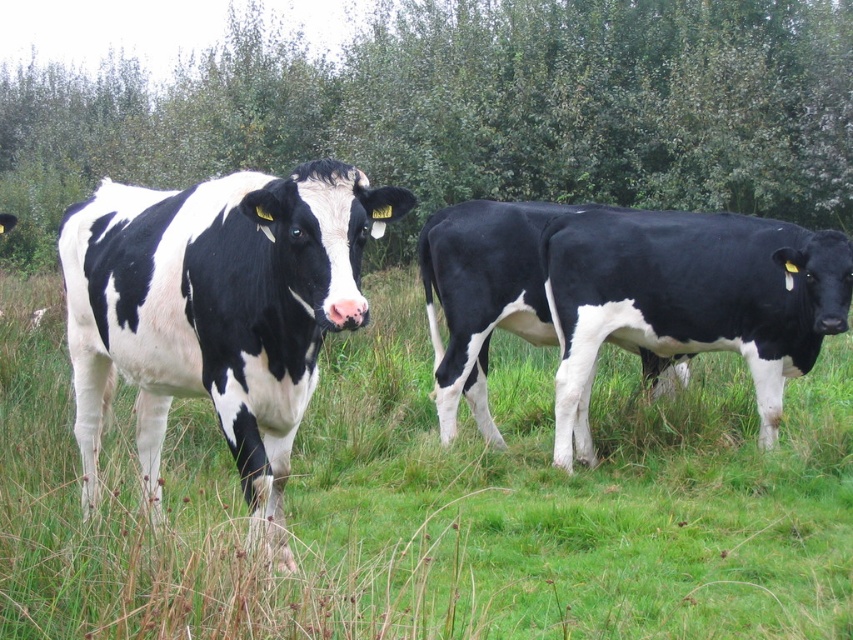
Question: Can you confirm if black and white cow at center is positioned to the left of green leafy tree at upper center?

Choices:
 (A) yes
 (B) no

Answer: (B)

Question: Which object is positioned farthest from the black smooth cow at center?

Choices:
 (A) black and white cow at center
 (B) black and white cow at left

Answer: (B)

Question: Which object is positioned farthest from the black and white cow at left?

Choices:
 (A) black smooth cow at center
 (B) black and white cow at center
 (C) green leafy tree at upper center

Answer: (C)

Question: Which object is positioned farthest from the black smooth cow at center?

Choices:
 (A) black and white cow at center
 (B) green leafy tree at upper center
 (C) black and white cow at left

Answer: (B)

Question: Where is black and white cow at left located in relation to black smooth cow at center in the image?

Choices:
 (A) right
 (B) left

Answer: (B)

Question: From the image, what is the correct spatial relationship of green leafy tree at upper center in relation to black and white cow at left?

Choices:
 (A) right
 (B) left

Answer: (B)